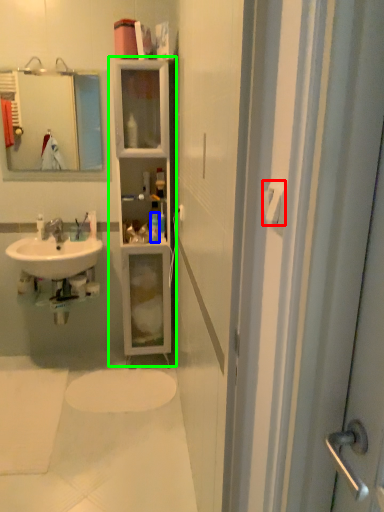
Question: Which object is the farthest from towel bar (highlighted by a red box)? Choose among these: toiletry (highlighted by a blue box) or bathroom cabinet (highlighted by a green box).

Choices:
 (A) toiletry
 (B) bathroom cabinet

Answer: (B)